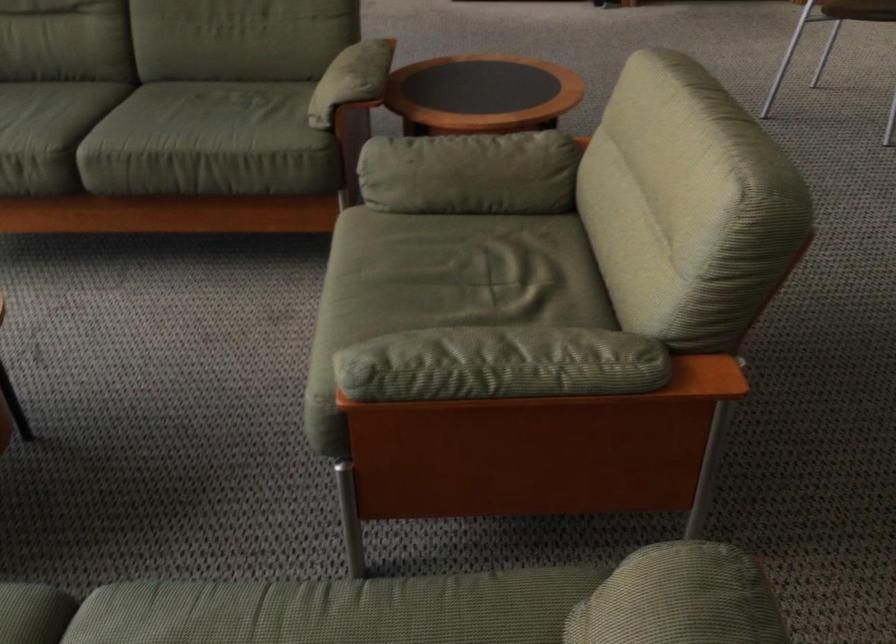
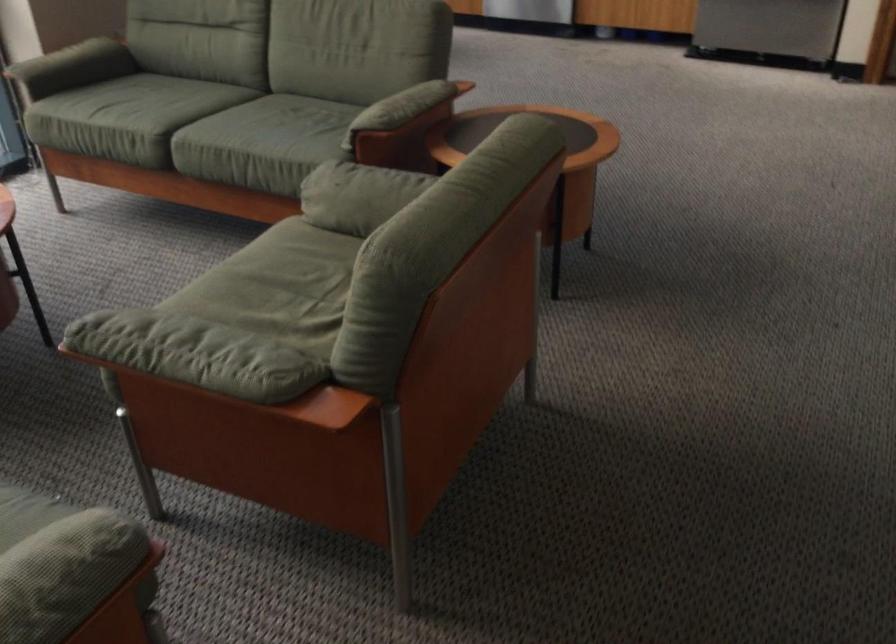
Question: The camera is either moving clockwise (left) or counter-clockwise (right) around the object. The first image is from the beginning of the video and the second image is from the end. Is the camera moving left or right when shooting the video?

Choices:
 (A) Left
 (B) Right

Answer: (B)